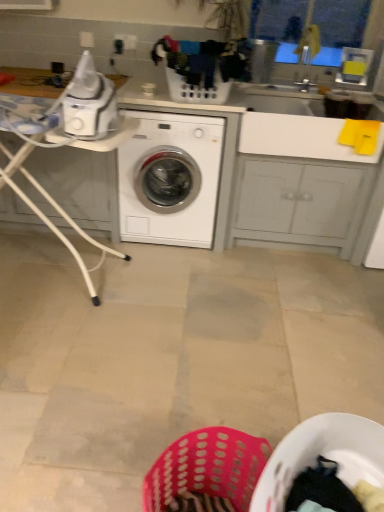
Identify the location of free space in front of white plastic table at left. (66, 349).